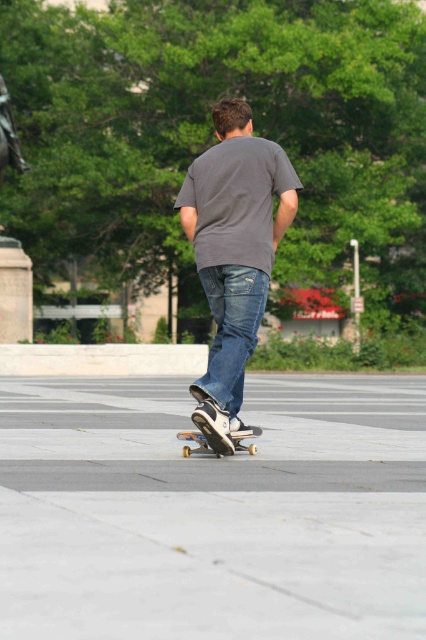
Question: Based on their relative distances, which object is farther from the denim jeans at center?

Choices:
 (A) matte gray t-shirt at center
 (B) wooden skateboard at center
 (C) smooth concrete skateboard at center

Answer: (C)

Question: From the image, what is the correct spatial relationship of smooth concrete skateboard at center in relation to denim jeans at center?

Choices:
 (A) right
 (B) left

Answer: (B)

Question: Which object appears closest to the camera in this image?

Choices:
 (A) smooth concrete skateboard at center
 (B) wooden skateboard at center

Answer: (A)

Question: Can you confirm if smooth concrete skateboard at center is thinner than wooden skateboard at center?

Choices:
 (A) yes
 (B) no

Answer: (B)

Question: Is matte gray t-shirt at center thinner than denim jeans at center?

Choices:
 (A) yes
 (B) no

Answer: (B)

Question: Which object appears closest to the camera in this image?

Choices:
 (A) wooden skateboard at center
 (B) smooth concrete skateboard at center
 (C) denim jeans at center

Answer: (B)